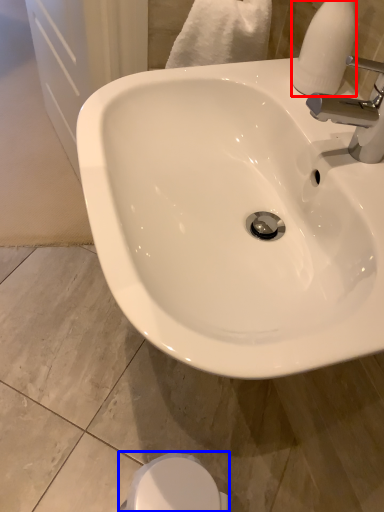
Question: Which of the following is the farthest to the observer, soap dispenser (highlighted by a red box) or bidet (highlighted by a blue box)?

Choices:
 (A) soap dispenser
 (B) bidet

Answer: (B)